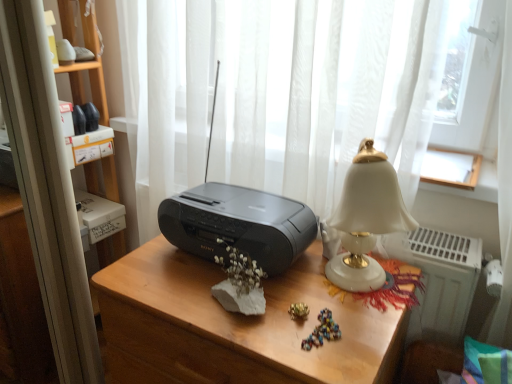
Question: Is white porcelain lamp at right wider than black plastic stereo at center?

Choices:
 (A) yes
 (B) no

Answer: (B)

Question: Is white porcelain lamp at right facing away from black plastic stereo at center?

Choices:
 (A) no
 (B) yes

Answer: (A)

Question: Is white porcelain lamp at right to the right of black plastic stereo at center from the viewer's perspective?

Choices:
 (A) no
 (B) yes

Answer: (B)

Question: Can you confirm if white porcelain lamp at right is shorter than black plastic stereo at center?

Choices:
 (A) no
 (B) yes

Answer: (B)

Question: Is white porcelain lamp at right far away from black plastic stereo at center?

Choices:
 (A) no
 (B) yes

Answer: (A)

Question: Which is correct: matte black radio at center is inside white porcelain lamp at right, or outside of it?

Choices:
 (A) inside
 (B) outside

Answer: (B)

Question: Does point (321, 360) appear closer or farther from the camera than point (356, 281)?

Choices:
 (A) closer
 (B) farther

Answer: (A)

Question: Would you say matte black radio at center is to the left or to the right of white porcelain lamp at right in the picture?

Choices:
 (A) right
 (B) left

Answer: (B)

Question: Relative to white porcelain lamp at right, is matte black radio at center in front or behind?

Choices:
 (A) behind
 (B) front

Answer: (B)

Question: From a real-world perspective, is matte black radio at center above or below black plastic stereo at center?

Choices:
 (A) above
 (B) below

Answer: (B)

Question: Choose the correct answer: Is matte black radio at center inside black plastic stereo at center or outside it?

Choices:
 (A) inside
 (B) outside

Answer: (B)

Question: From their relative heights in the image, would you say matte black radio at center is taller or shorter than black plastic stereo at center?

Choices:
 (A) tall
 (B) short

Answer: (A)

Question: Relative to black plastic stereo at center, is matte black radio at center in front or behind?

Choices:
 (A) behind
 (B) front

Answer: (B)

Question: From their relative heights in the image, would you say white porcelain lamp at right is taller or shorter than black plastic printer at center?

Choices:
 (A) tall
 (B) short

Answer: (A)

Question: Would you say white porcelain lamp at right is to the left or to the right of black plastic printer at center in the picture?

Choices:
 (A) left
 (B) right

Answer: (B)